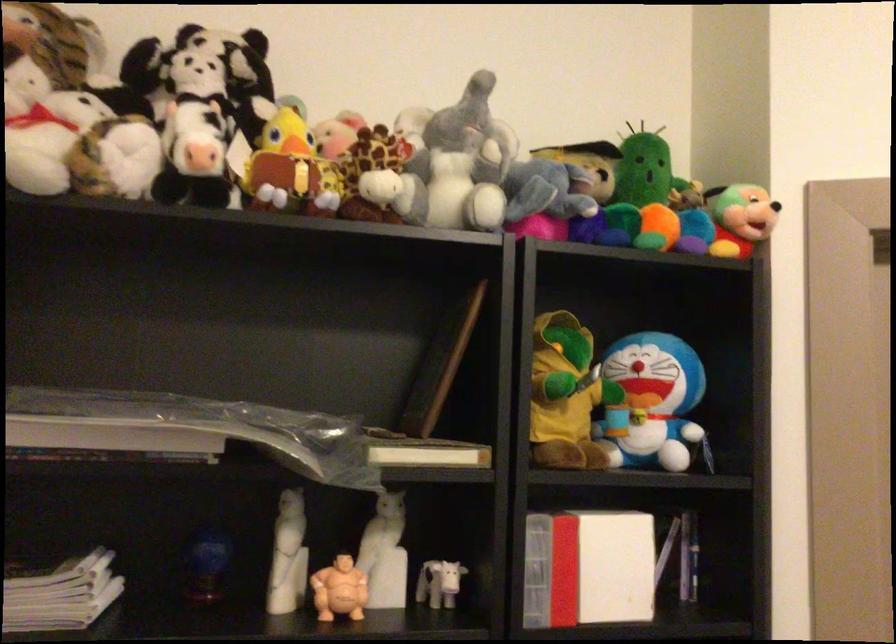
Which object does [316,169] point to?

It refers to a stuffed giraffe toy.